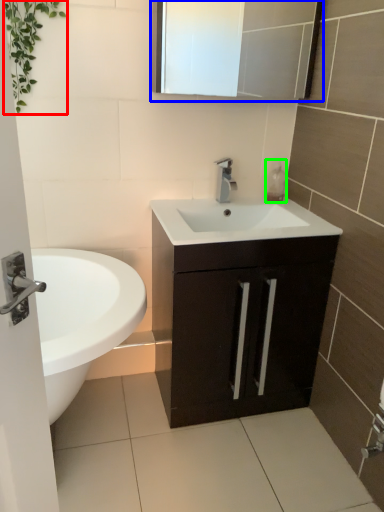
Question: Which object is the closest to the vegetation (highlighted by a red box)? Choose among these: medicine cabinet (highlighted by a blue box) or soap dispenser (highlighted by a green box).

Choices:
 (A) medicine cabinet
 (B) soap dispenser

Answer: (A)